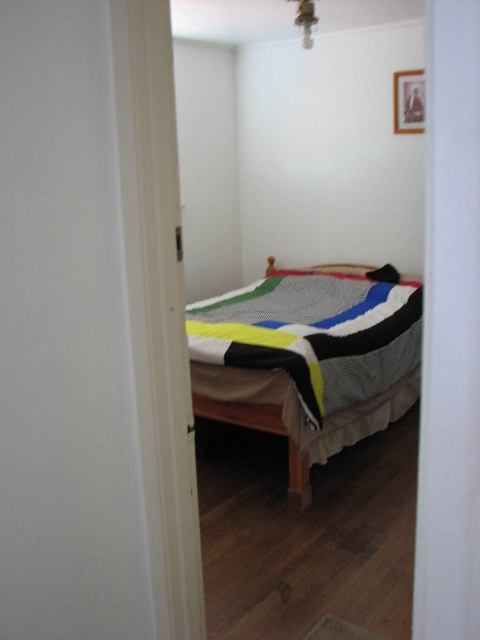
Question: Is knitted fabric bed at center positioned at the back of black fabric pillow at center?

Choices:
 (A) no
 (B) yes

Answer: (A)

Question: Which point is closer to the camera?

Choices:
 (A) knitted fabric bed at center
 (B) black fabric pillow at center

Answer: (A)

Question: Is knitted fabric bed at center to the left of black fabric pillow at center from the viewer's perspective?

Choices:
 (A) yes
 (B) no

Answer: (A)

Question: Which of the following is the closest to the observer?

Choices:
 (A) (213, 365)
 (B) (384, 273)

Answer: (A)

Question: Can you confirm if knitted fabric bed at center is bigger than black fabric pillow at center?

Choices:
 (A) no
 (B) yes

Answer: (B)

Question: Which object is farther from the camera taking this photo?

Choices:
 (A) knitted fabric bed at center
 (B) black fabric pillow at center

Answer: (B)